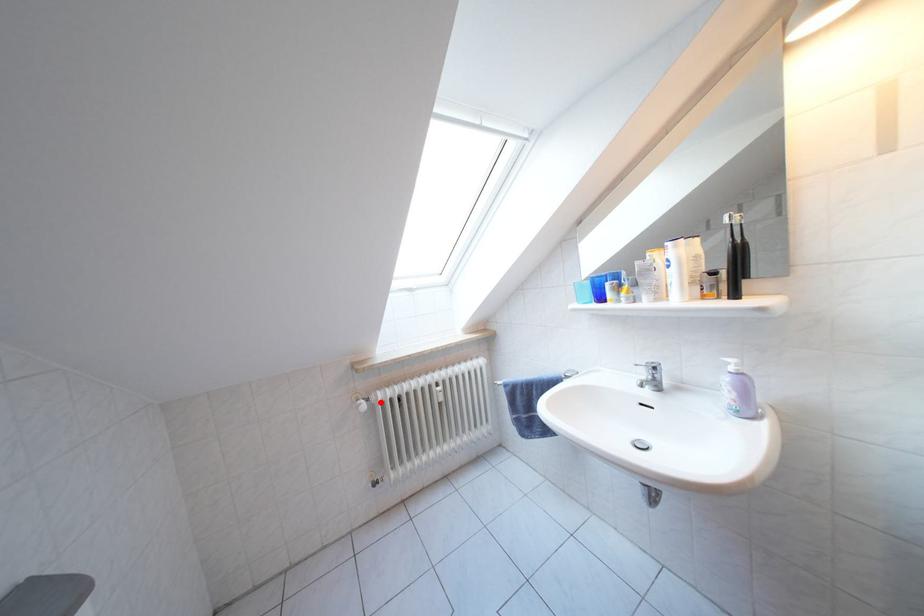
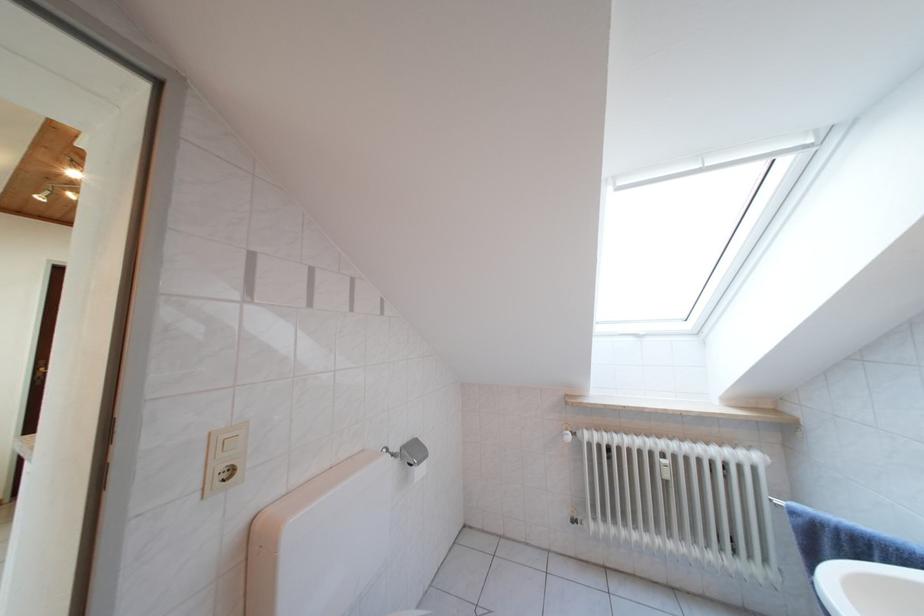
Question: I am providing you with two images of the same scene from different viewpoints. A red point is shown in image1. For the corresponding object point in image2, is it positioned nearer or farther from the camera?

Choices:
 (A) Nearer
 (B) Farther

Answer: (B)